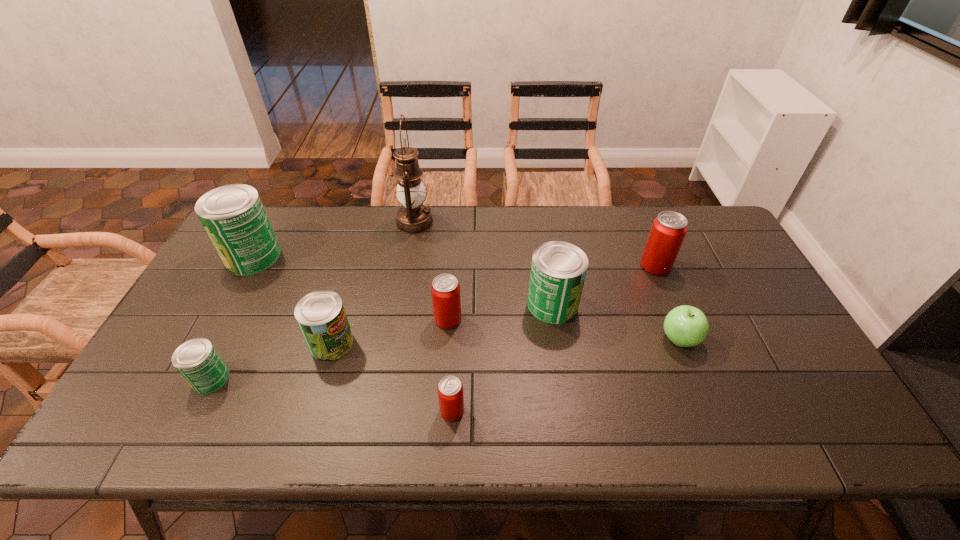
The width and height of the screenshot is (960, 540). Identify the location of red can that stands as the third closest to the farthest object. (668, 231).

Where is `free region that satisfies the following two spatial constraints: 1. on the back side of the third object from right to left; 2. on the left side of the second nearest red can`? The image size is (960, 540). free region that satisfies the following two spatial constraints: 1. on the back side of the third object from right to left; 2. on the left side of the second nearest red can is located at coordinates (449, 305).

Locate an element on the screen. The height and width of the screenshot is (540, 960). free space in the image that satisfies the following two spatial constraints: 1. on the back side of the smallest green can; 2. on the right side of the oil lamp is located at coordinates (288, 222).